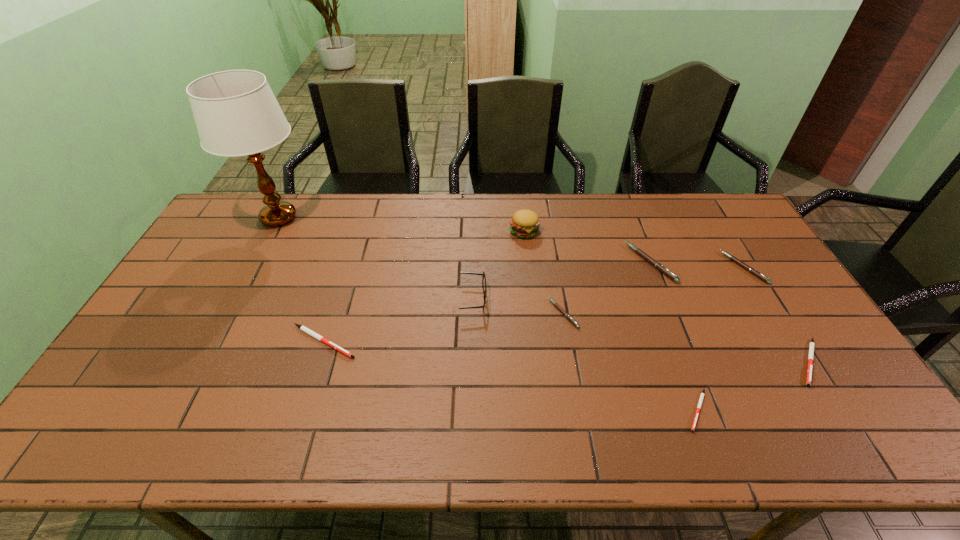
The height and width of the screenshot is (540, 960). Identify the location of table lamp. (236, 113).

Find the location of a particular element. The image size is (960, 540). brown table lamp is located at coordinates (236, 113).

The image size is (960, 540). What are the coordinates of `the eighth shortest object` in the screenshot? It's located at (525, 223).

What are the coordinates of `spectacles` in the screenshot? It's located at pos(483,274).

What are the coordinates of `the third tallest object` in the screenshot? It's located at (483, 274).

At what (x,y) coordinates should I click in order to perform the action: click on the tallest pen. Please return your answer as a coordinate pair (x, y). The height and width of the screenshot is (540, 960). Looking at the image, I should click on (657, 265).

Where is `the sixth shortest object`? the sixth shortest object is located at coordinates (657, 265).

Where is `the second smallest pink pen`? The width and height of the screenshot is (960, 540). the second smallest pink pen is located at coordinates (742, 264).

The height and width of the screenshot is (540, 960). Find the location of `the biggest white pen`. the biggest white pen is located at coordinates (303, 328).

This screenshot has width=960, height=540. I want to click on the eighth object from right to left, so click(303, 328).